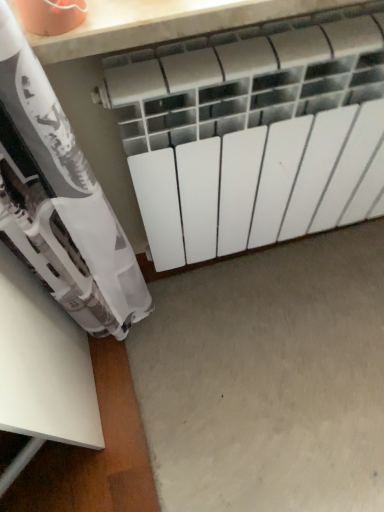
Identify the location of free region under white matte radiator at center (from a real-world perspective). This screenshot has height=512, width=384. (274, 263).